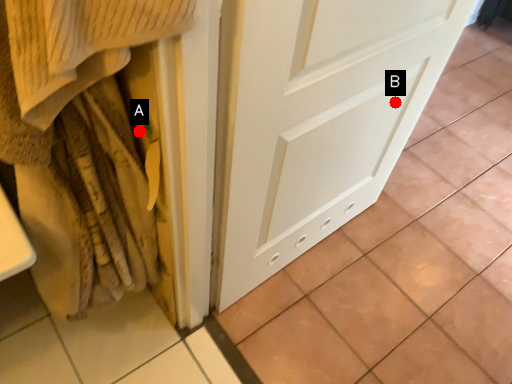
Question: Two points are circled on the image, labeled by A and B beside each circle. Which point appears closest to the camera in this image?

Choices:
 (A) A is closer
 (B) B is closer

Answer: (A)